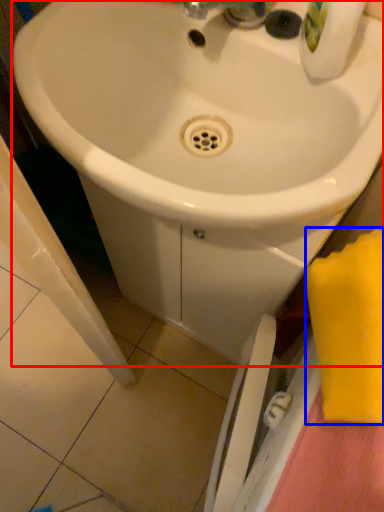
Question: Which point is closer to the camera, sink (highlighted by a red box) or beach towel (highlighted by a blue box)?

Choices:
 (A) sink
 (B) beach towel

Answer: (B)